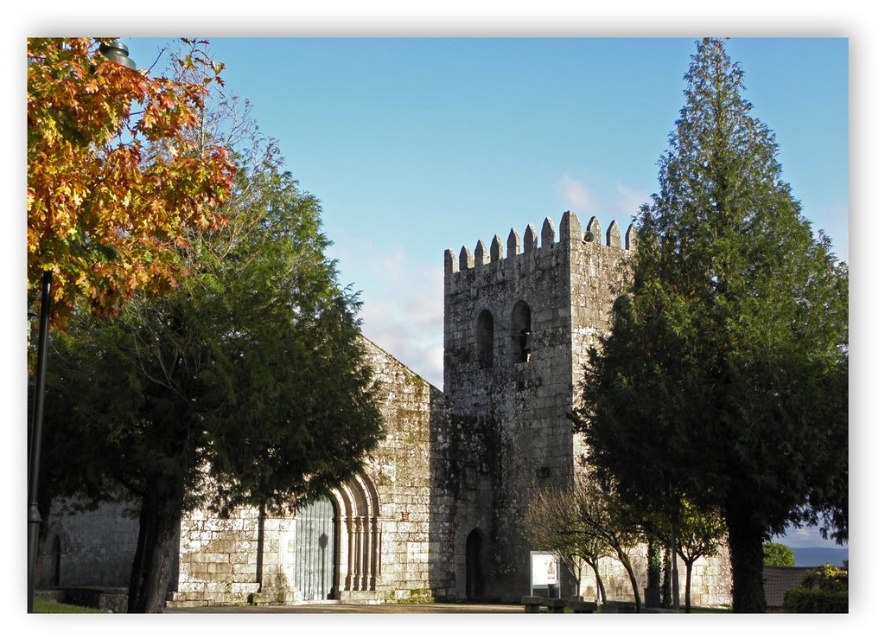
Locate an element on the screen. white stone tower at center is located at coordinates (440, 448).

Can you confirm if white stone tower at center is thinner than green textured tree at right?

In fact, white stone tower at center might be wider than green textured tree at right.

Is point (339, 572) closer to camera compared to point (612, 394)?

That is False.

The height and width of the screenshot is (640, 885). I want to click on white stone tower at center, so click(x=440, y=448).

Between autumn leaves at left and green textured tree at right, which one appears on the right side from the viewer's perspective?

green textured tree at right

Identify the location of autumn leaves at left. The image size is (885, 640). (178, 308).

Does autumn leaves at left appear over white stone tower at center?

Correct, autumn leaves at left is located above white stone tower at center.

Who is shorter, autumn leaves at left or white stone tower at center?

white stone tower at center is shorter.

Find the location of a particular element. The height and width of the screenshot is (640, 885). autumn leaves at left is located at coordinates tap(178, 308).